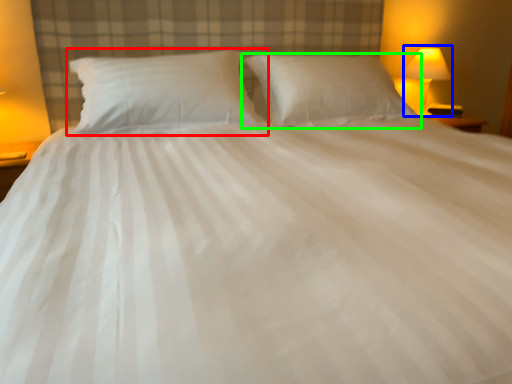
Question: Based on their relative distances, which object is farther from pillow (highlighted by a red box)? Choose from bedside lamp (highlighted by a blue box) and pillow (highlighted by a green box).

Choices:
 (A) bedside lamp
 (B) pillow

Answer: (A)